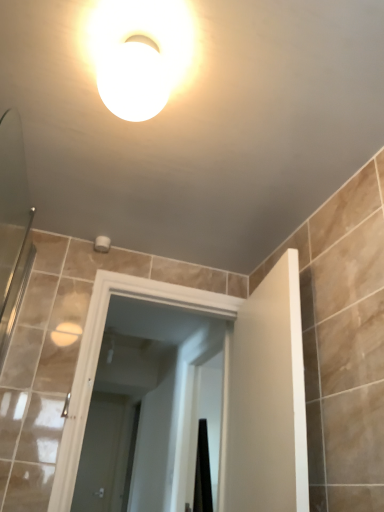
Looking at this image, measure the distance between white glossy door at center, the second screen door viewed from the top, and camera.

They are 3.86 meters apart.

Where is `white glossy door at center, which is counted as the 2th screen door, starting from the front`? white glossy door at center, which is counted as the 2th screen door, starting from the front is located at coordinates (104, 454).

From the image's perspective, between white glossy door at center, marked as the first screen door in a top-to-bottom arrangement, and white glossy light fixture at upper center, who is located below?

From the image's view, white glossy door at center, marked as the first screen door in a top-to-bottom arrangement, is below.

Is white glossy door at center, acting as the second screen door starting from the back, thinner than white glossy light fixture at upper center?

Indeed, white glossy door at center, acting as the second screen door starting from the back, has a lesser width compared to white glossy light fixture at upper center.

Image resolution: width=384 pixels, height=512 pixels. In order to click on the 1st screen door below the white glossy light fixture at upper center (from the image's perspective) in this screenshot , I will do [141, 403].

Could you tell me if white glossy door at center, the 1th screen door from the right, is turned towards white glossy light fixture at upper center?

Yes, white glossy door at center, the 1th screen door from the right, is turned towards white glossy light fixture at upper center.

Based on their positions, is white glossy light fixture at upper center located to the left or right of white glossy door at center, the second screen door positioned from the right?

Clearly, white glossy light fixture at upper center is on the right of white glossy door at center, the second screen door positioned from the right, in the image.

Which is less distant, [99,73] or [127,439]?

The point [99,73] is more forward.

Is white glossy light fixture at upper center oriented towards white glossy door at center, which is the first screen door in left-to-right order?

Yes, white glossy light fixture at upper center is oriented towards white glossy door at center, which is the first screen door in left-to-right order.

In terms of height, does white glossy light fixture at upper center look taller or shorter compared to white glossy door at center, which is counted as the 2th screen door, starting from the front?

In the image, white glossy light fixture at upper center appears to be shorter than white glossy door at center, which is counted as the 2th screen door, starting from the front.

Can you confirm if white glossy door at center, acting as the 1th screen door starting from the bottom, is thinner than white glossy door at center, marked as the 2th screen door in a left-to-right arrangement?

Yes.

Could you measure the distance between white glossy door at center, the second screen door positioned from the right, and white glossy door at center, marked as the first screen door in a top-to-bottom arrangement?

The distance of white glossy door at center, the second screen door positioned from the right, from white glossy door at center, marked as the first screen door in a top-to-bottom arrangement, is 16.20 inches.

Is white glossy door at center, the second screen door positioned from the right, facing towards white glossy door at center, the 1th screen door from the right?

Yes.

Between white glossy door at center, which is the first screen door in left-to-right order, and white glossy door at center, positioned as the 2th screen door in bottom-to-top order, which one appears on the right side from the viewer's perspective?

white glossy door at center, positioned as the 2th screen door in bottom-to-top order.

From a real-world perspective, between white glossy door at center, acting as the second screen door starting from the back, and white glossy door at center, acting as the 1th screen door starting from the bottom, who is vertically lower?

In real-world perspective, white glossy door at center, acting as the 1th screen door starting from the bottom, is lower.

In the scene shown: Is white glossy door at center, marked as the 2th screen door in a left-to-right arrangement, positioned with its back to white glossy door at center, the second screen door viewed from the top?

Yes.

Is white glossy door at center, marked as the first screen door in a top-to-bottom arrangement, not near white glossy door at center, acting as the 1th screen door starting from the bottom?

No, white glossy door at center, marked as the first screen door in a top-to-bottom arrangement, is in close proximity to white glossy door at center, acting as the 1th screen door starting from the bottom.

Looking at this image, does white glossy door at center, the 1th screen door when ordered from front to back, have a larger size compared to white glossy door at center, the first screen door when ordered from back to front?

Indeed, white glossy door at center, the 1th screen door when ordered from front to back, has a larger size compared to white glossy door at center, the first screen door when ordered from back to front.

Where is `light fixture in front of the white glossy door at center, marked as the 2th screen door in a left-to-right arrangement`? The image size is (384, 512). light fixture in front of the white glossy door at center, marked as the 2th screen door in a left-to-right arrangement is located at coordinates (142, 54).

Is white glossy light fixture at upper center far from white glossy door at center, marked as the 2th screen door in a left-to-right arrangement?

white glossy light fixture at upper center is positioned a significant distance from white glossy door at center, marked as the 2th screen door in a left-to-right arrangement.

Is white glossy light fixture at upper center turned away from white glossy door at center, positioned as the 2th screen door in bottom-to-top order?

No, white glossy light fixture at upper center is not facing away from white glossy door at center, positioned as the 2th screen door in bottom-to-top order.

Consider the image. From a real-world perspective, between white glossy light fixture at upper center and white glossy door at center, marked as the first screen door in a top-to-bottom arrangement, who is vertically lower?

white glossy door at center, marked as the first screen door in a top-to-bottom arrangement, from a real-world perspective.

Is white glossy door at center, acting as the 1th screen door starting from the bottom, inside or outside of white glossy light fixture at upper center?

white glossy door at center, acting as the 1th screen door starting from the bottom, is located beyond the bounds of white glossy light fixture at upper center.

At what (x,y) coordinates should I click in order to perform the action: click on light fixture located above the white glossy door at center, the second screen door viewed from the top (from a real-world perspective). Please return your answer as a coordinate pair (x, y). The height and width of the screenshot is (512, 384). Looking at the image, I should click on (142, 54).

From the image's perspective, which is below, white glossy door at center, acting as the 1th screen door starting from the bottom, or white glossy light fixture at upper center?

white glossy door at center, acting as the 1th screen door starting from the bottom, is shown below in the image.

Can you confirm if white glossy door at center, the second screen door viewed from the top, is thinner than white glossy light fixture at upper center?

Correct, the width of white glossy door at center, the second screen door viewed from the top, is less than that of white glossy light fixture at upper center.

Where is `light fixture above the white glossy door at center, the 1th screen door when ordered from front to back (from the image's perspective)`? The width and height of the screenshot is (384, 512). light fixture above the white glossy door at center, the 1th screen door when ordered from front to back (from the image's perspective) is located at coordinates (142, 54).

The height and width of the screenshot is (512, 384). Identify the location of screen door that is the 2nd one when counting backward from the white glossy light fixture at upper center. (104, 454).

Looking at the image, which one is located closer to white glossy door at center, which is the first screen door in left-to-right order, white glossy door at center, marked as the 2th screen door in a left-to-right arrangement, or white glossy light fixture at upper center?

Among the two, white glossy door at center, marked as the 2th screen door in a left-to-right arrangement, is located nearer to white glossy door at center, which is the first screen door in left-to-right order.

Looking at the image, which one is located further to white glossy door at center, the 1th screen door from the right, white glossy light fixture at upper center or white glossy door at center, acting as the 1th screen door starting from the bottom?

Among the two, white glossy light fixture at upper center is located further to white glossy door at center, the 1th screen door from the right.

Based on their spatial positions, is white glossy door at center, the second screen door positioned from the right, or white glossy light fixture at upper center closer to white glossy door at center, marked as the first screen door in a top-to-bottom arrangement?

white glossy door at center, the second screen door positioned from the right.

From the image, which object appears to be farther from white glossy light fixture at upper center, white glossy door at center, acting as the second screen door starting from the back, or white glossy door at center, the second screen door viewed from the top?

white glossy door at center, the second screen door viewed from the top, is positioned further to the anchor white glossy light fixture at upper center.

In the scene shown: When comparing their distances from white glossy light fixture at upper center, does white glossy door at center, which is the first screen door in left-to-right order, or white glossy door at center, the 1th screen door when ordered from front to back, seem further?

Among the two, white glossy door at center, which is the first screen door in left-to-right order, is located further to white glossy light fixture at upper center.

Looking at the image, which one is located closer to white glossy door at center, the second screen door viewed from the top, white glossy light fixture at upper center or white glossy door at center, positioned as the 2th screen door in bottom-to-top order?

The object closer to white glossy door at center, the second screen door viewed from the top, is white glossy door at center, positioned as the 2th screen door in bottom-to-top order.

Find the location of a particular element. The height and width of the screenshot is (512, 384). screen door located between white glossy light fixture at upper center and white glossy door at center, acting as the 1th screen door starting from the bottom, in the depth direction is located at coordinates (141, 403).